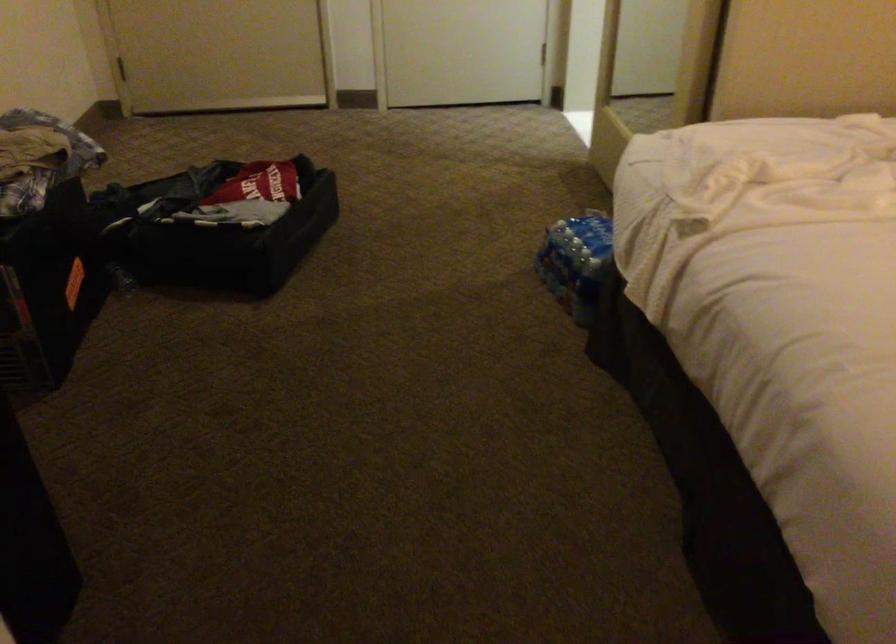
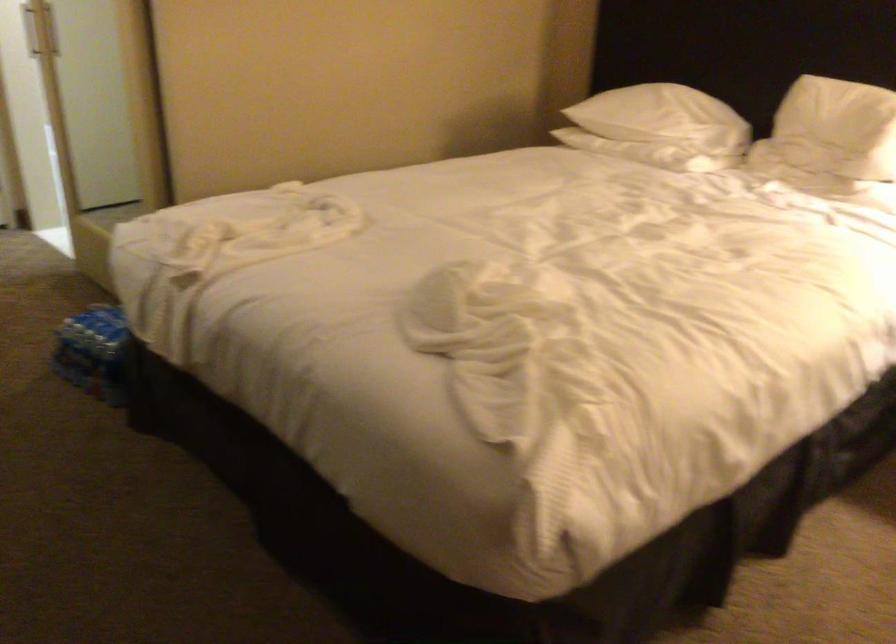
Question: The first image is from the beginning of the video and the second image is from the end. How did the camera likely rotate when shooting the video?

Choices:
 (A) Left
 (B) Right
 (C) Up
 (D) Down

Answer: (B)